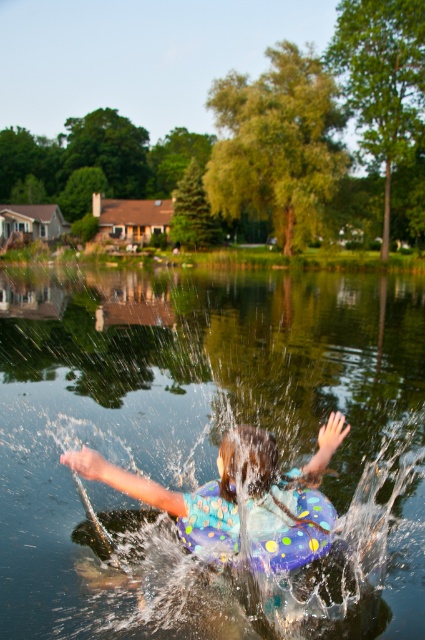
Looking at this image, you are a photographer trying to capture the child splashing water. You notice two items floating in the water, the polka dot floaty at center and the polka dot rubber life jacket at center. Since you want to include both in your shot, can you fit them both in the frame if your camera has a minimum focus distance of 2 inches?

The polka dot floaty at center and polka dot rubber life jacket at center are 2.09 inches apart. Since the distance between them is slightly more than 2 inches, the camera with a minimum focus distance of 2 inches can capture both items in the frame as they are just over the required distance.

In the scene shown: You are a photographer trying to capture the reflection of the polka dot floaty at center and the clear water at center in the lake. Which object will have a more distorted reflection due to the water surface?

The clear water at center has a much taller reflection than the polka dot floaty at center because it is taller, so its reflection would be more distorted.

You are a photographer trying to capture the reflection of the polka dot floaty at center and the polka dot rubber life jacket at center in the lake. Which object will have its reflection closer to the photographer?

The polka dot floaty at center is in front of the polka dot rubber life jacket at center, so its reflection will be closer to the photographer.